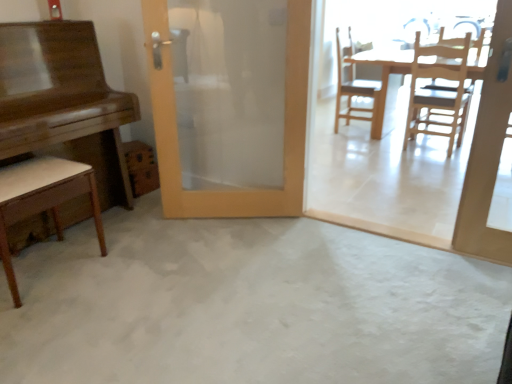
Question: Can you confirm if light wood table at center, which is the 2th table in front-to-back order, is bigger than wooden at right, the second chair in the right-to-left sequence?

Choices:
 (A) yes
 (B) no

Answer: (A)

Question: Can you confirm if light wood table at center, which is the 2th table in front-to-back order, is positioned to the right of wooden at right, which is the second chair from left to right?

Choices:
 (A) no
 (B) yes

Answer: (B)

Question: Does light wood table at center, the second table when ordered from left to right, have a greater height compared to wooden at right, which ranks as the 1th chair in back-to-front order?

Choices:
 (A) yes
 (B) no

Answer: (B)

Question: From a real-world perspective, is light wood table at center, the second table when ordered from left to right, positioned under wooden at right, which is the second chair from left to right, based on gravity?

Choices:
 (A) no
 (B) yes

Answer: (B)

Question: Is light wood table at center, the second table when ordered from left to right, smaller than wooden at right, which ranks as the 1th chair in back-to-front order?

Choices:
 (A) yes
 (B) no

Answer: (B)

Question: Is white concrete floor at center inside or outside of light wood table at center, marked as the 1th table in a back-to-front arrangement?

Choices:
 (A) outside
 (B) inside

Answer: (A)

Question: Is point (414, 281) positioned closer to the camera than point (394, 59)?

Choices:
 (A) closer
 (B) farther

Answer: (A)

Question: Based on their sizes in the image, would you say white concrete floor at center is bigger or smaller than light wood table at center, marked as the 1th table in a back-to-front arrangement?

Choices:
 (A) small
 (B) big

Answer: (A)

Question: Visually, is white concrete floor at center positioned to the left or to the right of light wood table at center, the second table when ordered from left to right?

Choices:
 (A) right
 (B) left

Answer: (B)

Question: Is wooden at right, which ranks as the 1th chair in back-to-front order, to the left or to the right of shiny brown piano at left, which is the first table in front-to-back order, in the image?

Choices:
 (A) left
 (B) right

Answer: (B)

Question: Considering the positions of wooden at right, the second chair in the right-to-left sequence, and shiny brown piano at left, positioned as the first table in left-to-right order, in the image, is wooden at right, the second chair in the right-to-left sequence, bigger or smaller than shiny brown piano at left, positioned as the first table in left-to-right order,?

Choices:
 (A) big
 (B) small

Answer: (B)

Question: Choose the correct answer: Is wooden at right, which is the second chair from left to right, inside shiny brown piano at left, which is the first table in front-to-back order, or outside it?

Choices:
 (A) inside
 (B) outside

Answer: (B)

Question: Is wooden at right, which ranks as the 1th chair in back-to-front order, wider or thinner than shiny brown piano at left, positioned as the first table in left-to-right order?

Choices:
 (A) wide
 (B) thin

Answer: (B)

Question: Relative to light brown wood chair at lower left, which ranks as the 3th chair in back-to-front order, is wooden door at center in front or behind?

Choices:
 (A) front
 (B) behind

Answer: (B)

Question: From their relative heights in the image, would you say wooden door at center is taller or shorter than light brown wood chair at lower left, which ranks as the 3th chair in back-to-front order?

Choices:
 (A) tall
 (B) short

Answer: (A)